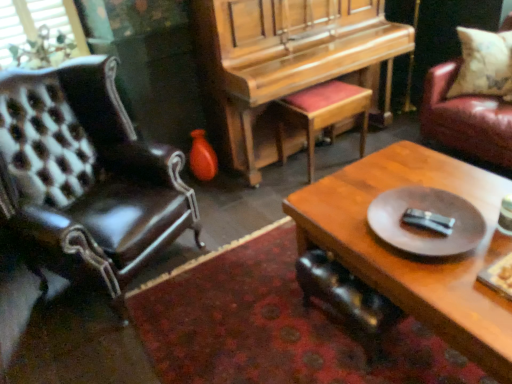
The height and width of the screenshot is (384, 512). What are the coordinates of `vacant space positioned to the left of wooden coffee table at center` in the screenshot? It's located at (243, 306).